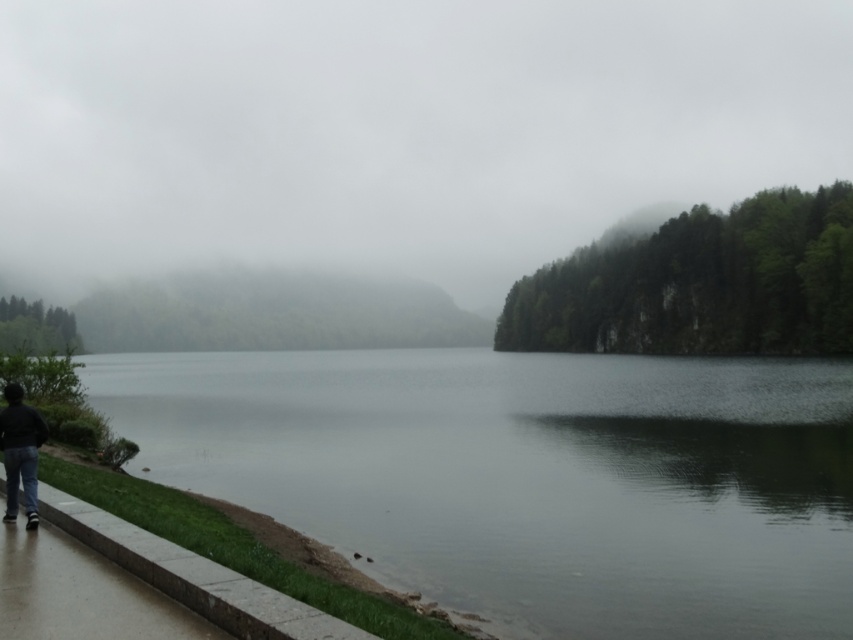
The height and width of the screenshot is (640, 853). Describe the element at coordinates (529, 477) in the screenshot. I see `smooth gray water at center` at that location.

Who is positioned more to the left, smooth gray water at center or dark blue jeans at lower left?

smooth gray water at center

Which is in front, point (775, 404) or point (13, 515)?

Point (13, 515) is more forward.

This screenshot has width=853, height=640. What are the coordinates of `smooth gray water at center` in the screenshot? It's located at (529, 477).